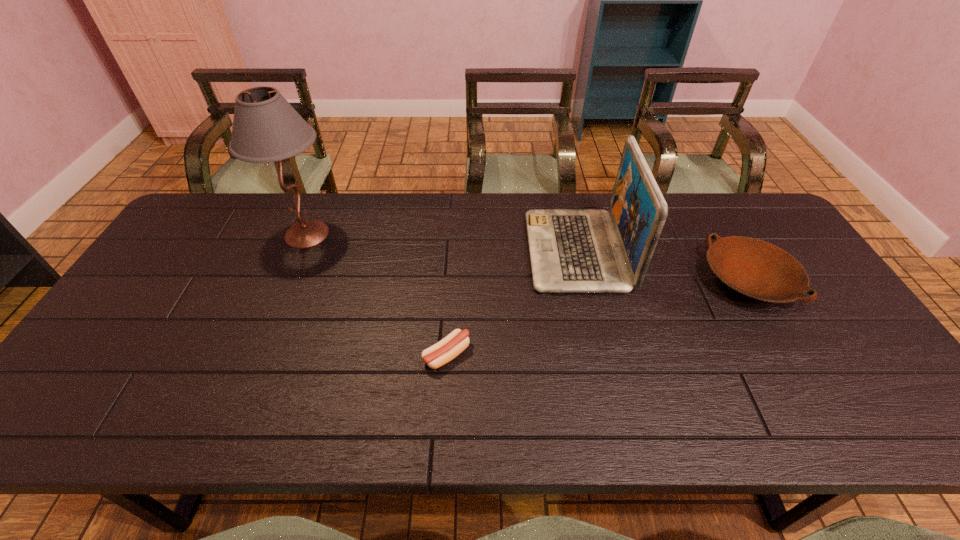
In order to click on table lamp in this screenshot , I will do coord(266,128).

You are a GUI agent. You are given a task and a screenshot of the screen. Output one action in this format:
    pyautogui.click(x=<x>, y=<y>)
    Task: Click on the leftmost object
    The image size is (960, 540).
    Given the screenshot: What is the action you would take?
    pyautogui.click(x=266, y=128)

What are the coordinates of `the third shortest object` in the screenshot? It's located at (572, 250).

Locate an element on the screen. Image resolution: width=960 pixels, height=540 pixels. laptop computer is located at coordinates (572, 250).

Where is `plate`? The image size is (960, 540). plate is located at coordinates (757, 269).

Locate an element on the screen. This screenshot has width=960, height=540. the third tallest object is located at coordinates (757, 269).

I want to click on the shortest object, so click(x=437, y=355).

At what (x,y) coordinates should I click in order to perform the action: click on sausage. Please return your answer as a coordinate pair (x, y). This screenshot has height=540, width=960. Looking at the image, I should click on (437, 355).

Image resolution: width=960 pixels, height=540 pixels. In order to click on vacant space located on the front-facing side of the tallest object in this screenshot , I will do `click(444, 234)`.

Find the location of a particular element. free space located on the screen of the second tallest object is located at coordinates (420, 251).